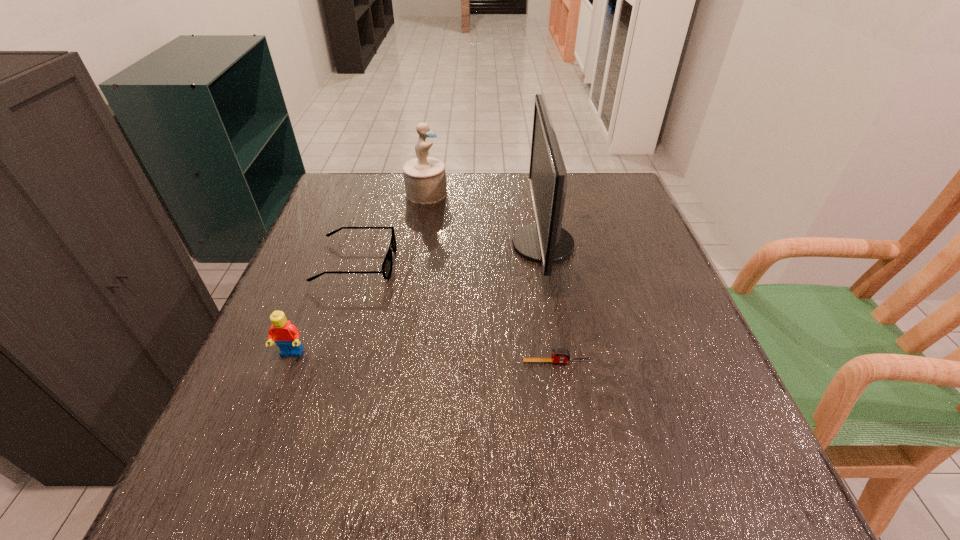
Image resolution: width=960 pixels, height=540 pixels. I want to click on vacant position located on the front-facing side of the second shortest object, so pyautogui.click(x=569, y=262).

Where is `free spot located 0.320m on the left of the tape measure`? free spot located 0.320m on the left of the tape measure is located at coordinates (348, 362).

Locate an element on the screen. monitor that is at the far edge is located at coordinates (545, 241).

The height and width of the screenshot is (540, 960). Find the location of `figurine located at the far edge`. figurine located at the far edge is located at coordinates (425, 178).

Find the location of `Lego that is at the left edge`. Lego that is at the left edge is located at coordinates (286, 335).

I want to click on spectacles located at the left edge, so click(387, 265).

The width and height of the screenshot is (960, 540). In order to click on vacant area at the far edge of the desktop in this screenshot , I will do `click(403, 181)`.

In the image, there is a desktop. At what (x,y) coordinates should I click in order to perform the action: click on vacant space at the near edge. Please return your answer as a coordinate pair (x, y). The width and height of the screenshot is (960, 540). Looking at the image, I should click on (353, 458).

I want to click on free spot at the left edge of the desktop, so click(x=367, y=248).

At what (x,y) coordinates should I click in order to perform the action: click on free spot at the right edge of the desktop. Please return your answer as a coordinate pair (x, y). The width and height of the screenshot is (960, 540). Looking at the image, I should click on (646, 314).